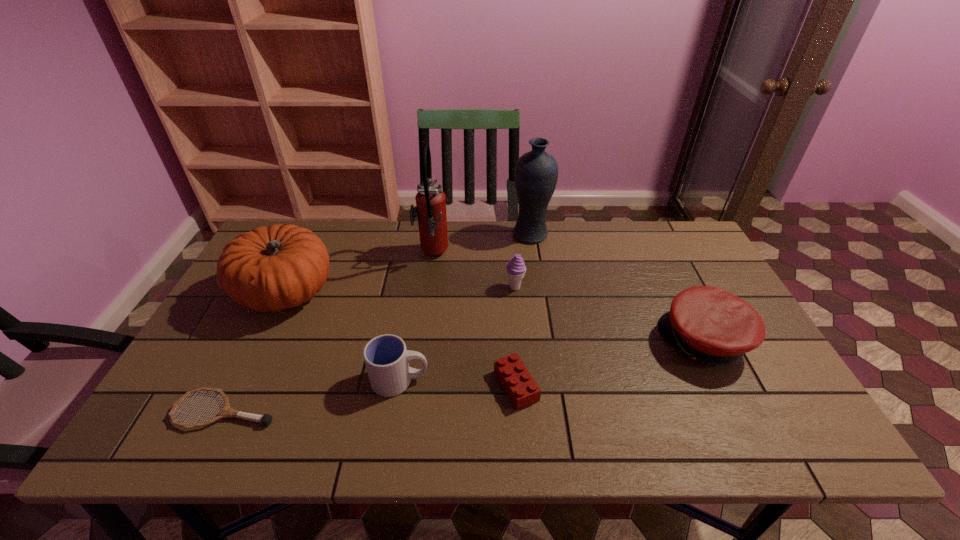
Locate an element on the screen. The image size is (960, 540). fire extinguisher is located at coordinates 430,208.

Find the location of a particular element. This screenshot has width=960, height=540. vase is located at coordinates (536, 172).

Locate an element on the screen. The width and height of the screenshot is (960, 540). the third tallest object is located at coordinates (273, 268).

Where is `icecream`? This screenshot has width=960, height=540. icecream is located at coordinates (516, 269).

Find the location of a particular element. cup is located at coordinates (386, 358).

This screenshot has height=540, width=960. I want to click on the rightmost object, so coord(709,324).

Find the location of `the seventh tallest object`. the seventh tallest object is located at coordinates (520, 386).

Find the location of a particular element. the shortest object is located at coordinates (266, 419).

Locate an element on the screen. free space located 0.290m at the nozzle of the fire extinguisher is located at coordinates (539, 255).

Find the location of a particular element. This screenshot has width=960, height=540. vacant space situated 0.050m on the front of the vase is located at coordinates (534, 255).